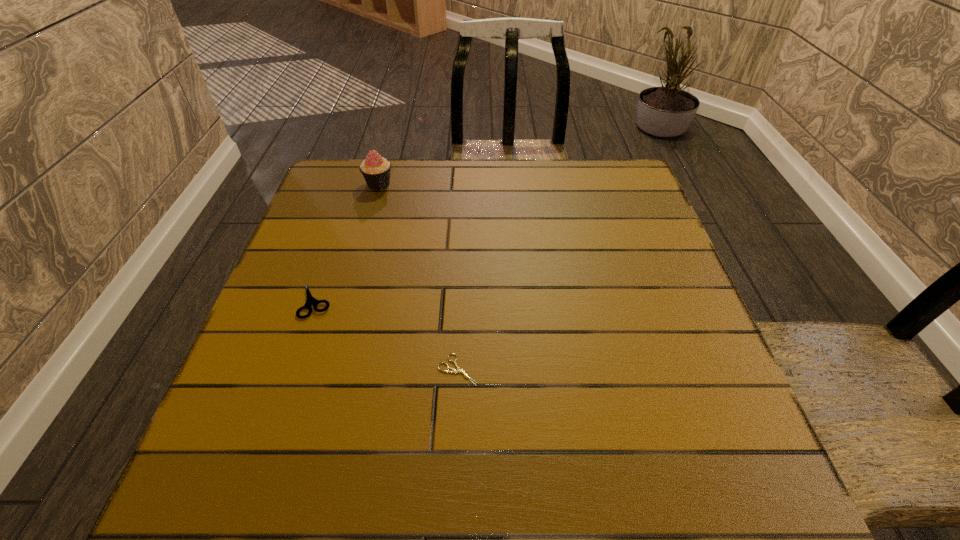
In order to click on vacant space that satisfies the following two spatial constraints: 1. on the front side of the shorter shears; 2. on the left side of the cupcake in this screenshot , I will do `click(327, 370)`.